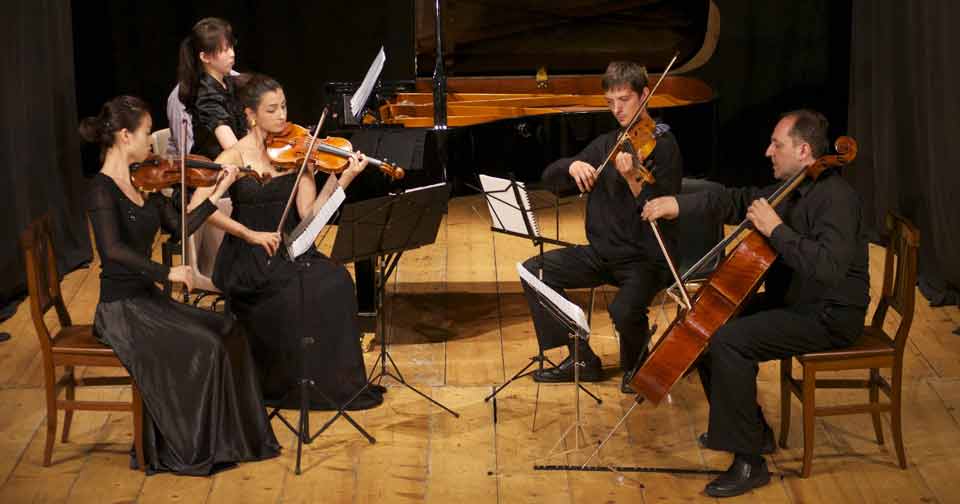
Identify the location of chairs. The height and width of the screenshot is (504, 960). (64, 332), (855, 344), (715, 267).